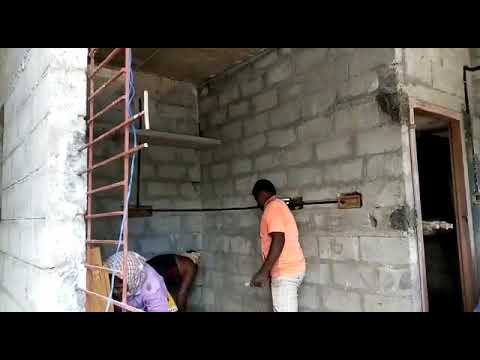
This screenshot has height=360, width=480. I want to click on doorway, so click(445, 179).